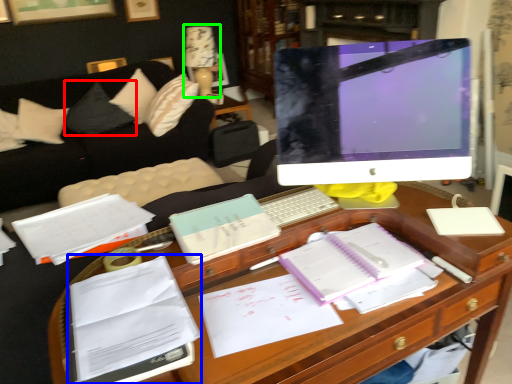
Question: Which object is the closest to the pillow (highlighted by a red box)? Choose among these: book (highlighted by a blue box) or table lamp (highlighted by a green box).

Choices:
 (A) book
 (B) table lamp

Answer: (B)